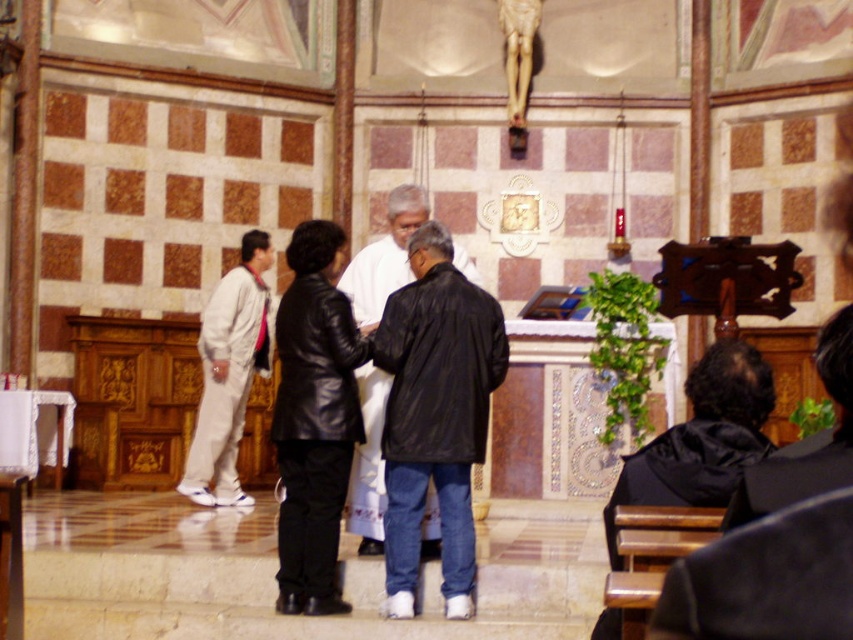
Question: Which of the following is the closest to the observer?

Choices:
 (A) light beige fabric pants at left
 (B) black leather jacket at lower right

Answer: (B)

Question: Can you confirm if black leather jacket at lower right is positioned to the left of black leather jacket at center?

Choices:
 (A) yes
 (B) no

Answer: (B)

Question: Can you confirm if black leather jacket at lower right is thinner than light beige fabric pants at left?

Choices:
 (A) yes
 (B) no

Answer: (A)

Question: Among these objects, which one is farthest from the camera?

Choices:
 (A) black leather jacket at center
 (B) black leather jacket at lower right
 (C) light beige fabric pants at left

Answer: (C)

Question: Can you confirm if black leather jacket at lower right is wider than light beige fabric pants at left?

Choices:
 (A) yes
 (B) no

Answer: (B)

Question: Which object is the closest to the black leather jacket at center?

Choices:
 (A) black leather jacket at lower right
 (B) light beige fabric pants at left

Answer: (B)